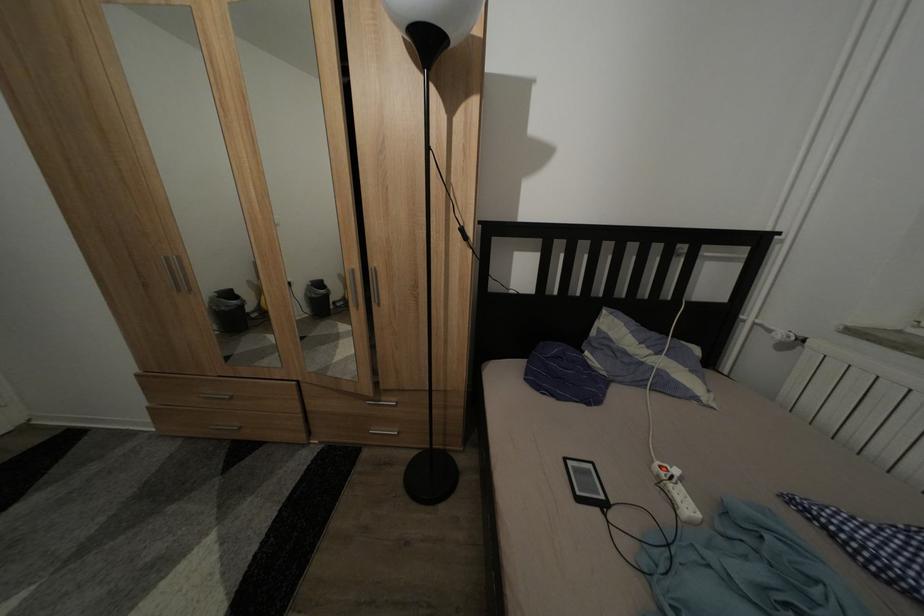
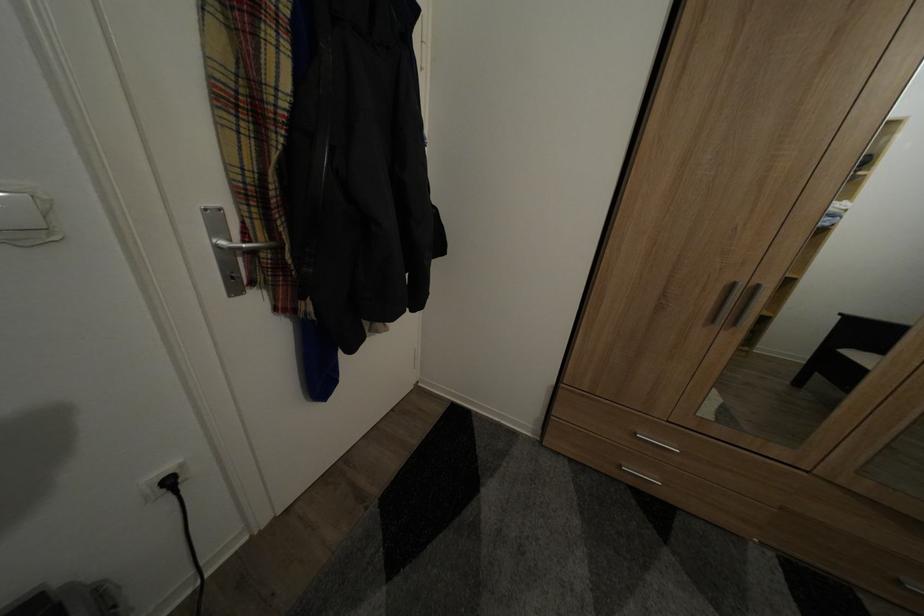
Question: The images are taken continuously from a first-person perspective. In which direction are you moving?

Choices:
 (A) Left
 (B) Right
 (C) Forward
 (D) Backward

Answer: (A)